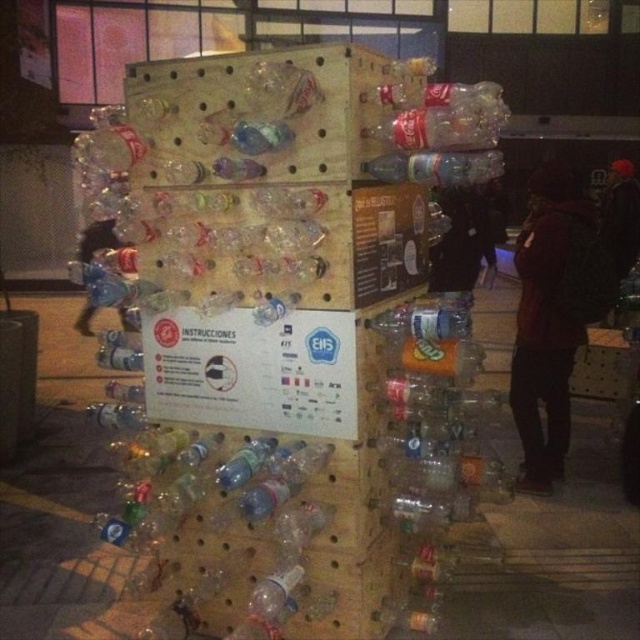
Question: Does dark red hoodie at right lie behind translucent plastic bottle at center?

Choices:
 (A) no
 (B) yes

Answer: (B)

Question: Does dark red hoodie at center lie in front of translucent plastic bottle at center?

Choices:
 (A) no
 (B) yes

Answer: (A)

Question: Which of these objects is positioned farthest from the dark red hoodie at right?

Choices:
 (A) dark red hoodie at center
 (B) translucent plastic bottle at center

Answer: (B)

Question: Is translucent plastic bottle at center smaller than clear plastic bottle at center?

Choices:
 (A) no
 (B) yes

Answer: (A)

Question: Among these objects, which one is farthest from the camera?

Choices:
 (A) translucent plastic bottle at center
 (B) clear plastic bottle at center
 (C) dark red hoodie at center
 (D) dark red hoodie at right

Answer: (D)

Question: Which point is farther to the camera?

Choices:
 (A) dark red hoodie at right
 (B) dark red hoodie at center

Answer: (A)